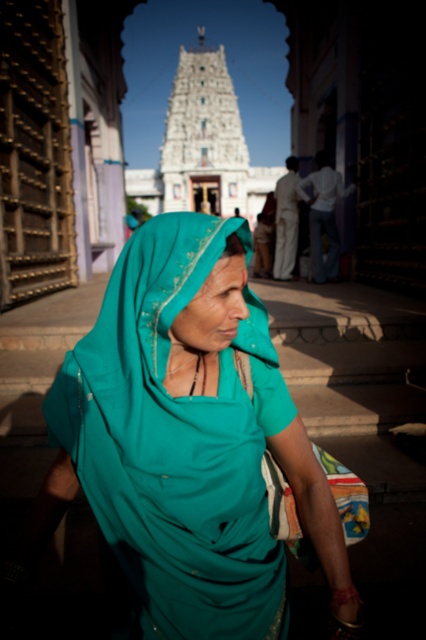
You are a visitor in the temple courtyard and see the teal fabric headscarf at center and the light brown cotton robe at center. Which one appears taller in the scene?

The teal fabric headscarf at center is much taller as light brown cotton robe at center.

Consider the image. You are standing in the temple courtyard and see two points marked in the image. The first point is at coordinates point (x=149, y=481), and the second point is at point (x=279, y=248). Which point is closer to you?

Point (x=149, y=481) is in front of point (x=279, y=248), so it is closer to you.

You are a fashion designer observing a woman in a temple courtyard. She is wearing a teal fabric headscarf at center and a light brown cotton robe at center. Which item of clothing has a bigger size?

The teal fabric headscarf at center has a larger size compared to the light brown cotton robe at center.